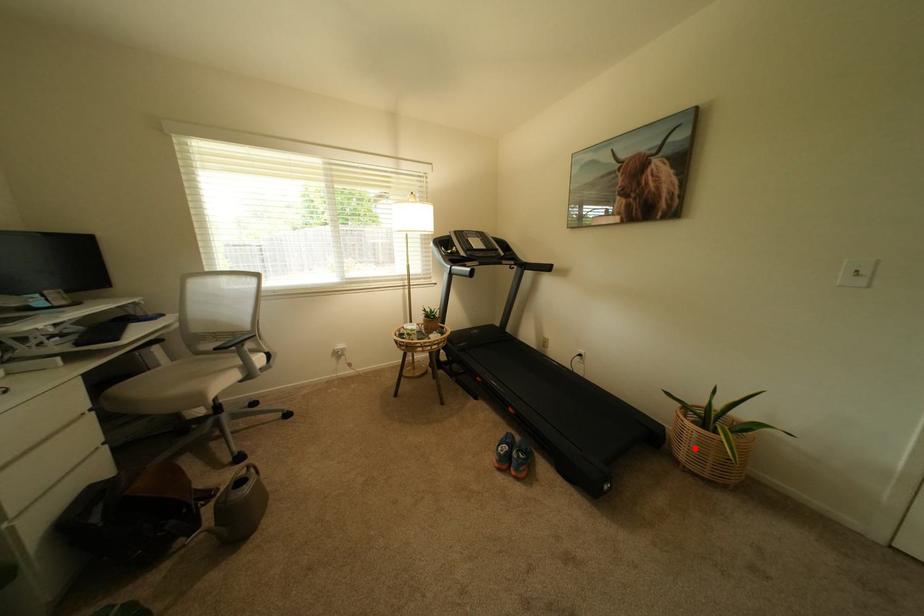
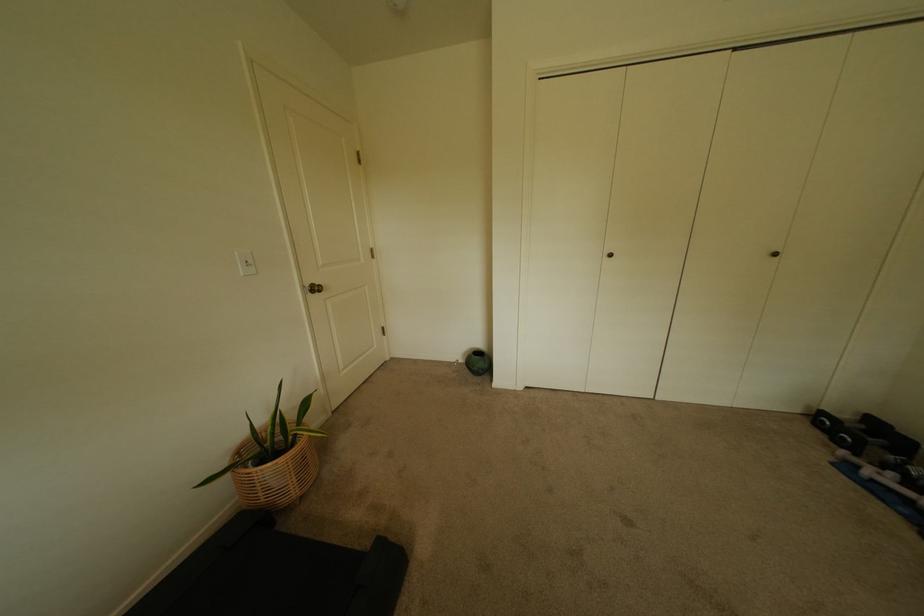
Question: I am providing you with two images of the same scene from different viewpoints. A red point is shown in image1. For the corresponding object point in image2, is it positioned nearer or farther from the camera?

Choices:
 (A) Nearer
 (B) Farther

Answer: (A)